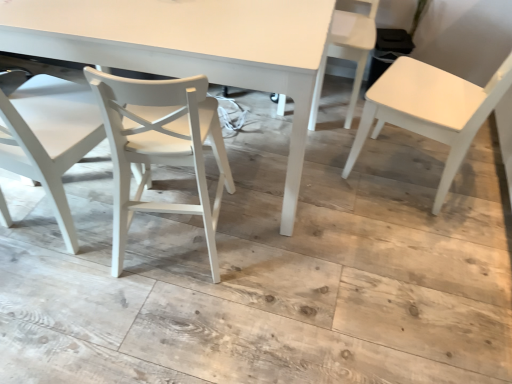
Find the location of `vacant area situated below white matte chair at right, arranged as the 1th chair when viewed from the right (from a real-world perspective)`. vacant area situated below white matte chair at right, arranged as the 1th chair when viewed from the right (from a real-world perspective) is located at coordinates (404, 170).